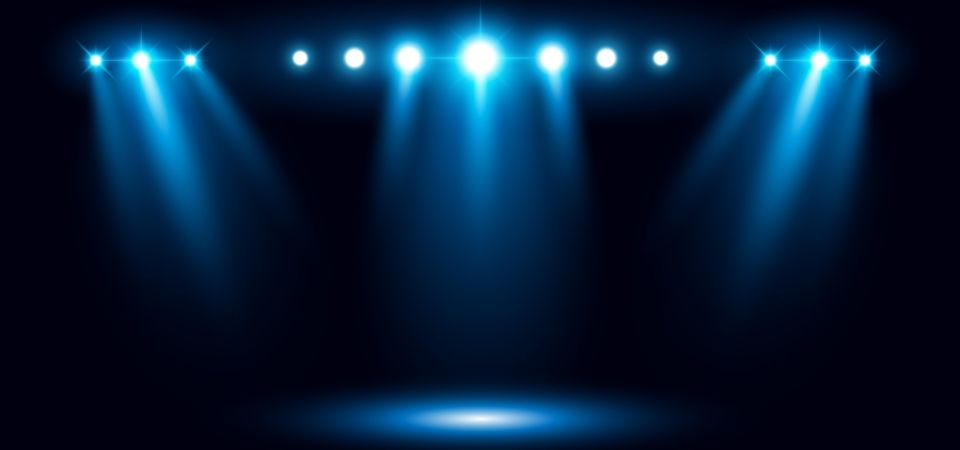
Identify the location of blue spotlight. This screenshot has width=960, height=450. (478, 154), (395, 130), (561, 130), (727, 135), (779, 158), (837, 166), (242, 139), (162, 153), (112, 166).